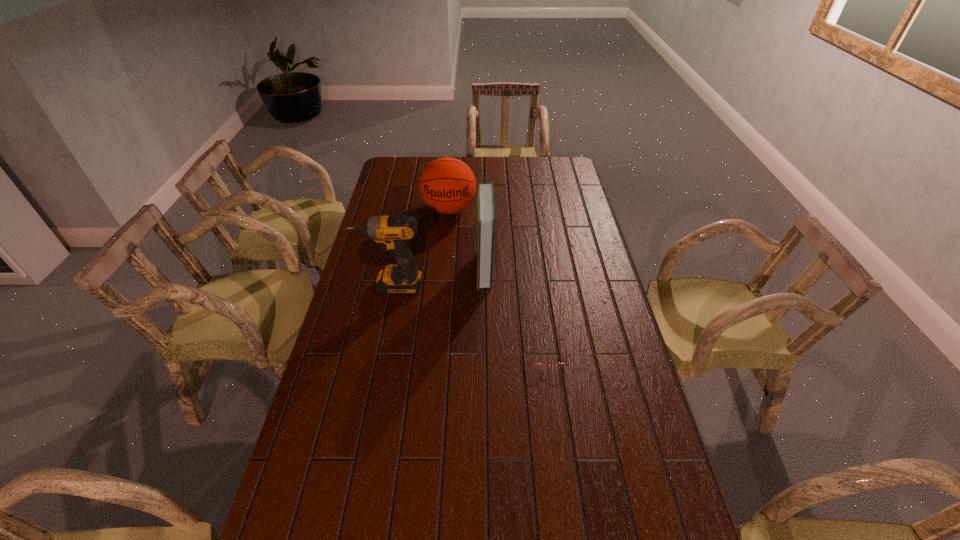
Where is `empty space between the drill and the hardback book`? The width and height of the screenshot is (960, 540). empty space between the drill and the hardback book is located at coordinates (438, 277).

You are a GUI agent. You are given a task and a screenshot of the screen. Output one action in this format:
    pyautogui.click(x=<x>, y=<y>)
    Task: Click on the empty space between the nearest object and the drill
    
    Given the screenshot: What is the action you would take?
    pyautogui.click(x=468, y=320)

Where is `vacant space that's between the farthest object and the drill`? vacant space that's between the farthest object and the drill is located at coordinates (420, 247).

Find the location of a particular element. The height and width of the screenshot is (540, 960). free space between the drill and the hardback book is located at coordinates (438, 277).

Locate an element on the screen. object that is the nearest to the nearest object is located at coordinates (486, 202).

Select which object appears as the second closest to the drill. Please provide its 2D coordinates. Your answer should be formatted as a tuple, i.e. [(x, y)], where the tuple contains the x and y coordinates of a point satisfying the conditions above.

[(447, 185)]